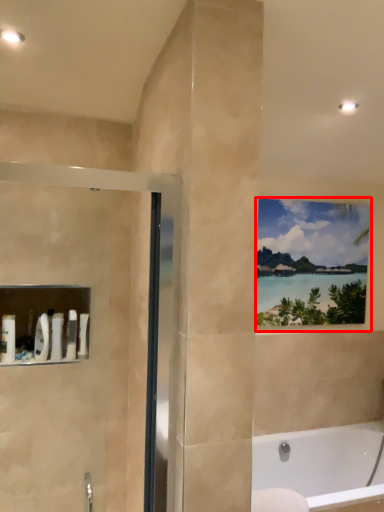
Question: From the image's perspective, considering the relative positions of window (annotated by the red box) and bathtub in the image provided, where is window (annotated by the red box) located with respect to the staircase?

Choices:
 (A) below
 (B) above

Answer: (B)